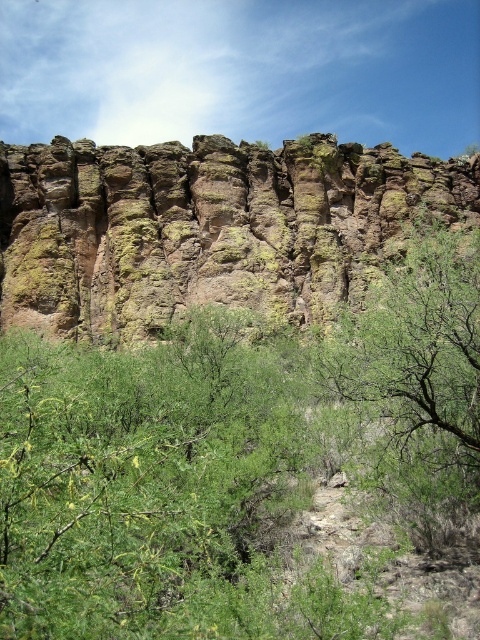
Question: Which of the following is the farthest from the observer?

Choices:
 (A) (276, 218)
 (B) (478, 385)

Answer: (A)

Question: Does rusty rock cliff at center appear over green leafy tree at center?

Choices:
 (A) yes
 (B) no

Answer: (A)

Question: Can you confirm if rusty rock cliff at center is thinner than green leafy tree at center?

Choices:
 (A) no
 (B) yes

Answer: (A)

Question: Can you confirm if rusty rock cliff at center is wider than green leafy tree at center?

Choices:
 (A) no
 (B) yes

Answer: (B)